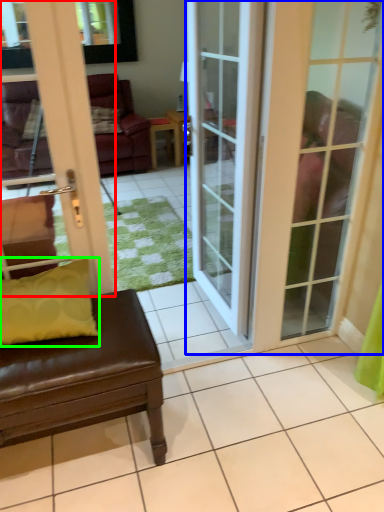
Question: Which is nearer to the door (highlighted by a red box)? door (highlighted by a blue box) or pillow (highlighted by a green box).

Choices:
 (A) door
 (B) pillow

Answer: (B)